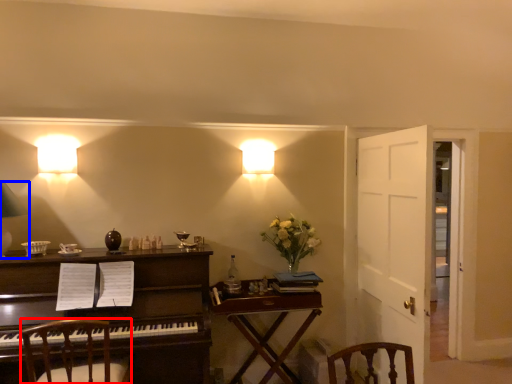
Question: Which object is further to the camera taking this photo, chair (highlighted by a red box) or lamp (highlighted by a blue box)?

Choices:
 (A) chair
 (B) lamp

Answer: (B)